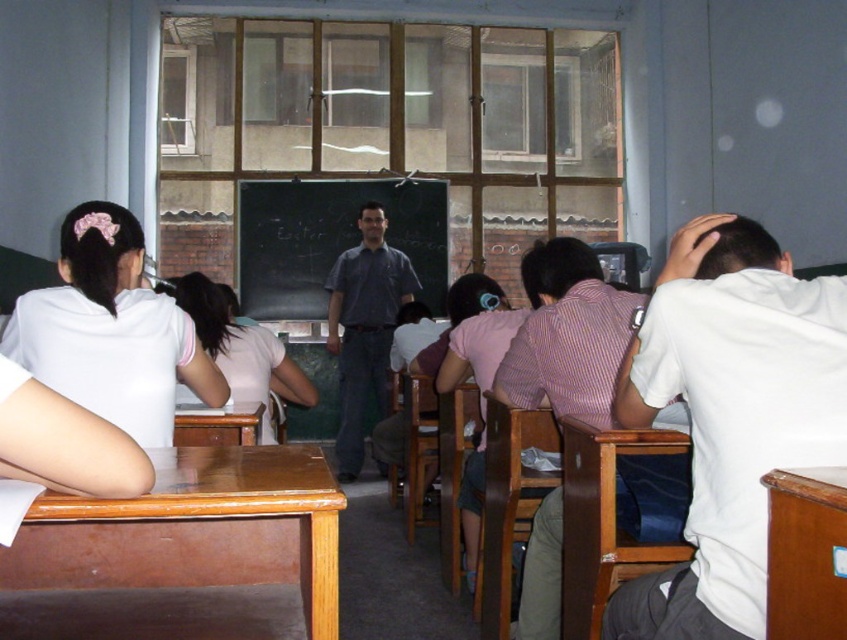
Between wooden desk at right and brown wooden desk at lower left, which one appears on the left side from the viewer's perspective?

Positioned to the left is brown wooden desk at lower left.

Consider the image. Is wooden desk at right further to camera compared to brown wooden desk at lower left?

No, it is not.

At what (x,y) coordinates should I click in order to perform the action: click on wooden desk at right. Please return your answer as a coordinate pair (x, y). The width and height of the screenshot is (847, 640). Looking at the image, I should click on (806, 554).

Is white matte shirt at right further to camera compared to striped shirt at center?

No, it is not.

Does point (609, 616) come farther from viewer compared to point (543, 557)?

No.

Who is more forward, (692, 576) or (535, 339)?

Point (692, 576) is in front.

I want to click on white matte shirt at right, so click(729, 416).

Can you confirm if brown polished wood table at lower left is shorter than wooden desk at right?

Yes.

Which of these two, brown polished wood table at lower left or wooden desk at right, stands shorter?

Standing shorter between the two is brown polished wood table at lower left.

You are a GUI agent. You are given a task and a screenshot of the screen. Output one action in this format:
    pyautogui.click(x=<x>, y=<y>)
    Task: Click on the brown polished wood table at lower left
    
    Given the screenshot: What is the action you would take?
    pyautogui.click(x=195, y=529)

Where is `brown polished wood table at lower left`? Image resolution: width=847 pixels, height=640 pixels. brown polished wood table at lower left is located at coordinates (195, 529).